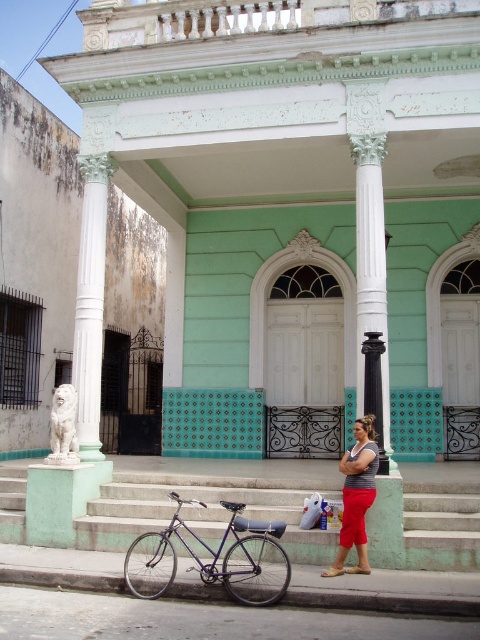
You are standing at the base of the stairs in the image. The point at coordinates (210, 500) marks the location of the smooth concrete stairs at center. If you want to reach the portico, which direction should you move relative to the stairs?

The point at coordinates (210, 500) marks the smooth concrete stairs at center. To reach the portico, you should move upward along the stairs.

You are standing at the bottom of the smooth concrete stairs at center and want to reach the white marble column at center. Which direction should you move to get closer to the column?

You should move upward along the smooth concrete stairs at center to get closer to the white marble column at center since the stairs are below the column.

You are an architect designing a new building and want to ensure the columns are wider than the people standing next to them. Looking at the image, does the white marble column at center meet this requirement when compared to the gray striped tank top at center?

The white marble column at center has a lesser width compared to the gray striped tank top at center, so it does not meet the requirement of being wider than the person.